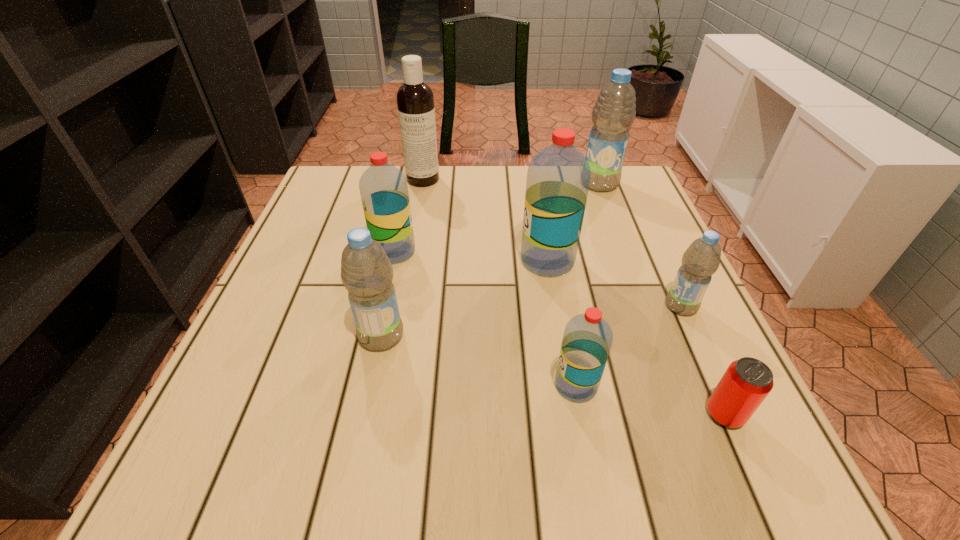
The height and width of the screenshot is (540, 960). Identify the location of free location that satisfies the following two spatial constraints: 1. on the front label of the leftmost red water bottle; 2. on the back side of the fourth farthest water bottle. (382, 306).

You are a GUI agent. You are given a task and a screenshot of the screen. Output one action in this format:
    pyautogui.click(x=<x>, y=<y>)
    Task: Click on the vacant point that satisfies the following two spatial constraints: 1. on the front label of the smallest red water bottle; 2. on the back side of the shortest object
    
    Given the screenshot: What is the action you would take?
    pyautogui.click(x=581, y=414)

You are a GUI agent. You are given a task and a screenshot of the screen. Output one action in this format:
    pyautogui.click(x=<x>, y=<y>)
    Task: Click on the free spot that satisfies the following two spatial constraints: 1. on the label side of the dishwasher detergent; 2. on the left side of the fourth farthest water bottle
    
    Given the screenshot: What is the action you would take?
    coord(400,306)

Locate an element on the screen. The image size is (960, 540). vacant position in the image that satisfies the following two spatial constraints: 1. on the front label of the biggest red water bottle; 2. on the back side of the can is located at coordinates (573, 414).